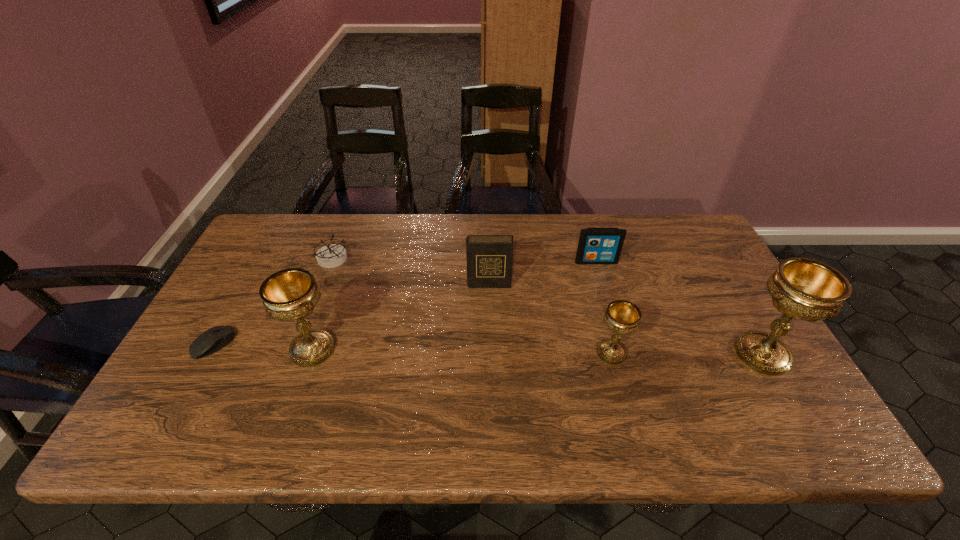
Where is `the leftmost chalice`? the leftmost chalice is located at coordinates (291, 294).

Locate an element on the screen. This screenshot has width=960, height=540. the sixth shortest object is located at coordinates (291, 294).

What are the coordinates of `the second chalice from left to right` in the screenshot? It's located at (623, 317).

In order to click on the rightmost object in this screenshot , I will do `click(806, 289)`.

Where is `iPod`? The image size is (960, 540). iPod is located at coordinates (596, 245).

The height and width of the screenshot is (540, 960). What are the coordinates of `the sixth tallest object` in the screenshot? It's located at (330, 256).

Find the location of a particular element. the fourth object from left to right is located at coordinates (489, 258).

This screenshot has width=960, height=540. Identify the location of the fifth nearest object. (489, 258).

Find the location of a particular element. This screenshot has width=960, height=540. computer equipment is located at coordinates (215, 338).

What are the coordinates of `the shortest object` in the screenshot? It's located at (215, 338).